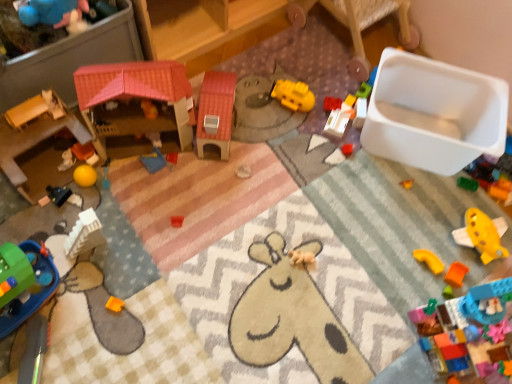
Find the location of a particular element. free location to the right of yellow matte plastic toy at center, which is the 8th toy from right to left is located at coordinates (338, 103).